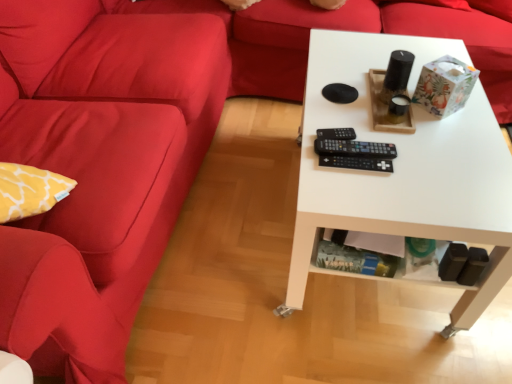
Question: Considering the relative sizes of black plastic remote at center, the 1th control when ordered from bottom to top, and white matte table at center in the image provided, is black plastic remote at center, the 1th control when ordered from bottom to top, thinner than white matte table at center?

Choices:
 (A) yes
 (B) no

Answer: (A)

Question: Does black plastic remote at center, the 1th control when ordered from bottom to top, touch white matte table at center?

Choices:
 (A) no
 (B) yes

Answer: (A)

Question: From a real-world perspective, is black plastic remote at center, the 1th control when ordered from bottom to top, on white matte table at center?

Choices:
 (A) no
 (B) yes

Answer: (B)

Question: Is white matte table at center a part of black plastic remote at center, which is counted as the third control, starting from the top?

Choices:
 (A) no
 (B) yes

Answer: (A)

Question: Is black plastic remote at center, which is counted as the third control, starting from the top, not inside white matte table at center?

Choices:
 (A) yes
 (B) no

Answer: (B)

Question: Is the position of black plastic remote at center, which is counted as the third control, starting from the top, more distant than that of white matte table at center?

Choices:
 (A) no
 (B) yes

Answer: (B)

Question: Can you confirm if white matte table at center is wider than velvet red couch at left?

Choices:
 (A) yes
 (B) no

Answer: (B)

Question: Would you say white matte table at center is a long distance from velvet red couch at left?

Choices:
 (A) yes
 (B) no

Answer: (B)

Question: Is white matte table at center oriented towards velvet red couch at left?

Choices:
 (A) yes
 (B) no

Answer: (B)

Question: Does white matte table at center have a lesser height compared to velvet red couch at left?

Choices:
 (A) no
 (B) yes

Answer: (B)

Question: Is velvet red couch at left a part of white matte table at center?

Choices:
 (A) yes
 (B) no

Answer: (B)

Question: Is white matte table at center turned away from velvet red couch at left?

Choices:
 (A) yes
 (B) no

Answer: (A)

Question: Does black plastic remote at center, arranged as the second control when viewed from the top, contain black plastic remote at center, which is counted as the third control, starting from the top?

Choices:
 (A) yes
 (B) no

Answer: (B)